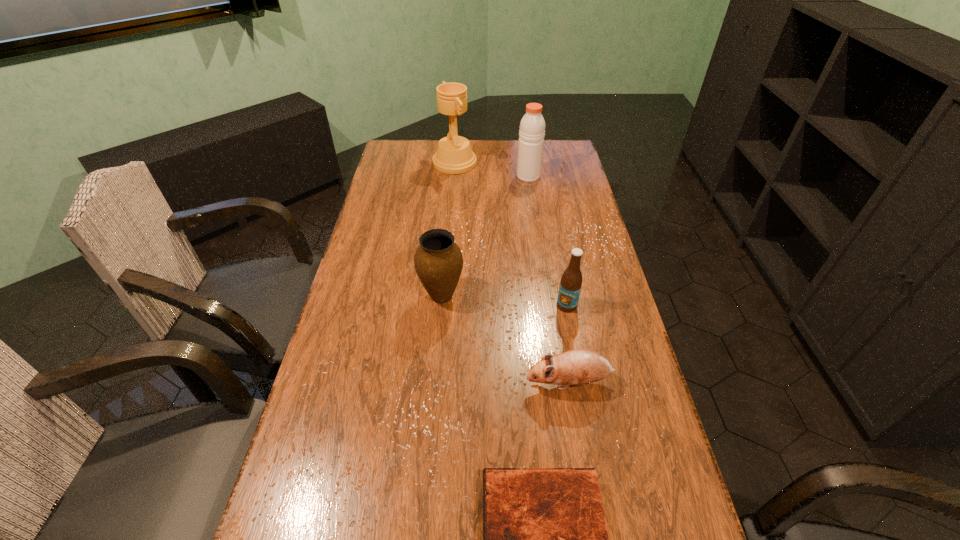
Where is `free space at the far left corner of the desktop`? This screenshot has height=540, width=960. free space at the far left corner of the desktop is located at coordinates (401, 165).

In the image, there is a desktop. Where is `vacant space at the far right corner`? The width and height of the screenshot is (960, 540). vacant space at the far right corner is located at coordinates (563, 166).

This screenshot has height=540, width=960. In order to click on unoccupied area between the hamster and the award in this screenshot , I will do `click(512, 273)`.

Identify the location of vacant space that is in between the award and the beer bottle. This screenshot has height=540, width=960. (511, 234).

Where is `blank region between the shaker and the award`? blank region between the shaker and the award is located at coordinates (492, 170).

Locate an element on the screen. The width and height of the screenshot is (960, 540). free spot between the urn and the beer bottle is located at coordinates (504, 301).

Identify the location of free space between the shaker and the beer bottle. The height and width of the screenshot is (540, 960). (547, 241).

Find the location of a particular element. free space between the beer bottle and the urn is located at coordinates (504, 301).

Where is `free space between the shaker and the award`? The image size is (960, 540). free space between the shaker and the award is located at coordinates (492, 170).

Locate an element on the screen. This screenshot has height=540, width=960. the third closest object relative to the second shortest object is located at coordinates (438, 261).